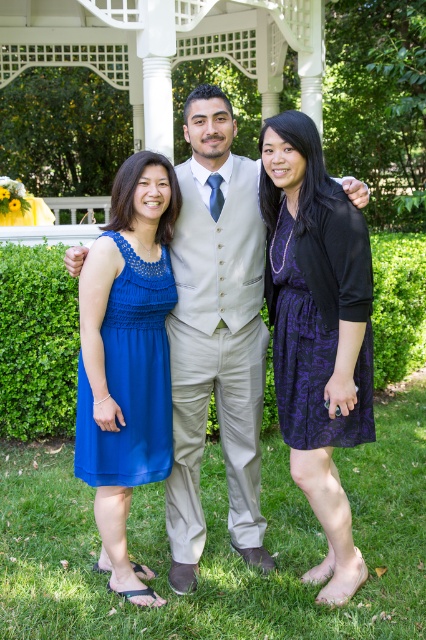
Between purple brocade dress at center and blue chiffon dress at left, which one is positioned lower?

blue chiffon dress at left is lower down.

Is purple brocade dress at center taller than blue chiffon dress at left?

Indeed, purple brocade dress at center has a greater height compared to blue chiffon dress at left.

Does point (328, 198) lie behind point (161, 278)?

That is False.

Where is `purple brocade dress at center`? Image resolution: width=426 pixels, height=640 pixels. purple brocade dress at center is located at coordinates click(x=319, y=321).

Which is more to the right, matte beige vest at center or blue chiffon dress at left?

From the viewer's perspective, matte beige vest at center appears more on the right side.

Does matte beige vest at center have a greater height compared to blue chiffon dress at left?

Correct, matte beige vest at center is much taller as blue chiffon dress at left.

Describe the element at coordinates (215, 336) in the screenshot. I see `matte beige vest at center` at that location.

Where is `matte beige vest at center`? matte beige vest at center is located at coordinates (215, 336).

Does purple satin dress at center appear under purple brocade dress at center?

Yes, purple satin dress at center is below purple brocade dress at center.

Is point (333, 204) less distant than point (325, 353)?

That is True.

Does point (310, 252) come in front of point (356, 216)?

That is False.

Where is `purple satin dress at center`? This screenshot has height=640, width=426. purple satin dress at center is located at coordinates (317, 332).